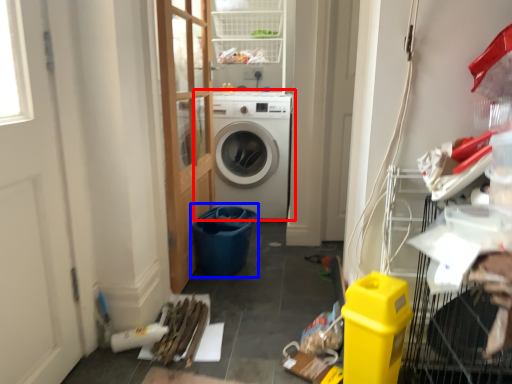
Question: Which of the following is the farthest to the observer, washing machine (highlighted by a red box) or recycling bin (highlighted by a blue box)?

Choices:
 (A) washing machine
 (B) recycling bin

Answer: (A)